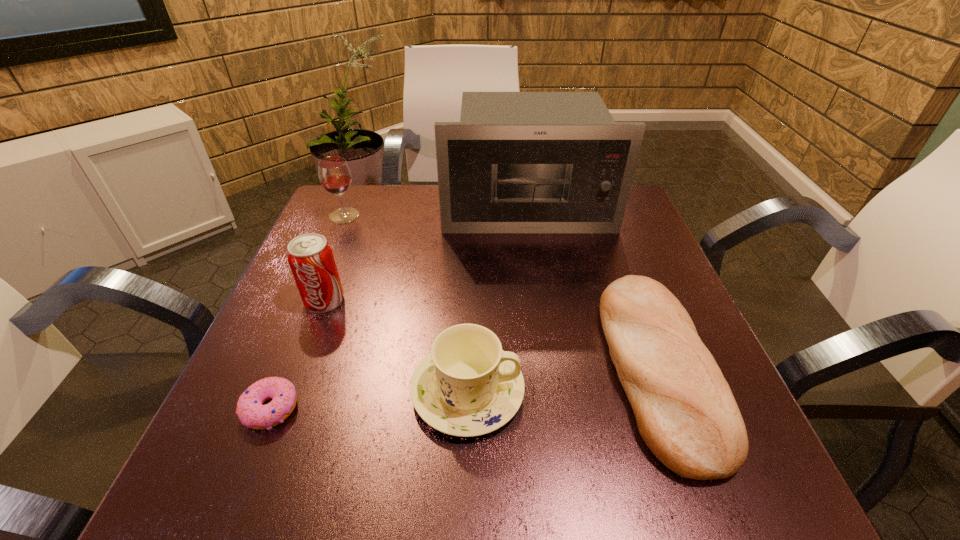
Locate an element on the screen. vacant space located on the left of the bread is located at coordinates (432, 368).

The image size is (960, 540). What are the coordinates of `free space located 0.320m on the back of the doughnut` in the screenshot? It's located at (328, 265).

Identify the location of microwave oven present at the far edge. The height and width of the screenshot is (540, 960). (517, 162).

Find the location of a particular element. Image resolution: width=960 pixels, height=540 pixels. wineglass that is at the far edge is located at coordinates (334, 173).

Where is `chinaware situated at the near edge`? This screenshot has width=960, height=540. chinaware situated at the near edge is located at coordinates (467, 386).

You are a GUI agent. You are given a task and a screenshot of the screen. Output one action in this format:
    pyautogui.click(x=<x>, y=<y>)
    Task: Click on the bread at the near edge
    The image size is (960, 540).
    Given the screenshot: What is the action you would take?
    pyautogui.click(x=685, y=411)

You are a GUI agent. You are given a task and a screenshot of the screen. Output one action in this format:
    pyautogui.click(x=<x>, y=<y>)
    Task: Click on the wineglass that is at the left edge
    This screenshot has width=960, height=540.
    Given the screenshot: What is the action you would take?
    pyautogui.click(x=334, y=173)

The image size is (960, 540). I want to click on soda can positioned at the left edge, so click(310, 257).

Find the location of a particular element. doughnut present at the left edge is located at coordinates (250, 411).

Identify the location of microwave oven that is positioned at the right edge. This screenshot has width=960, height=540. (517, 162).